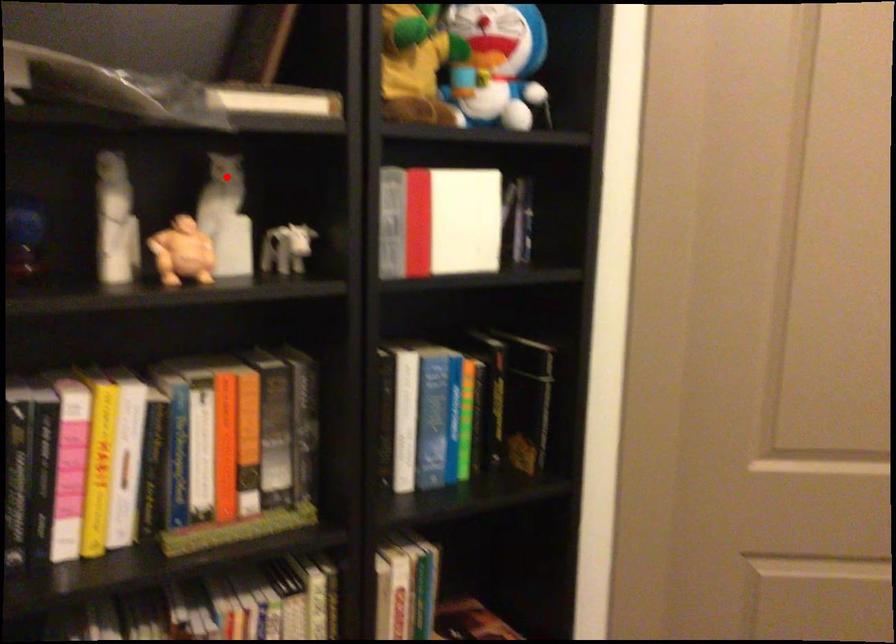
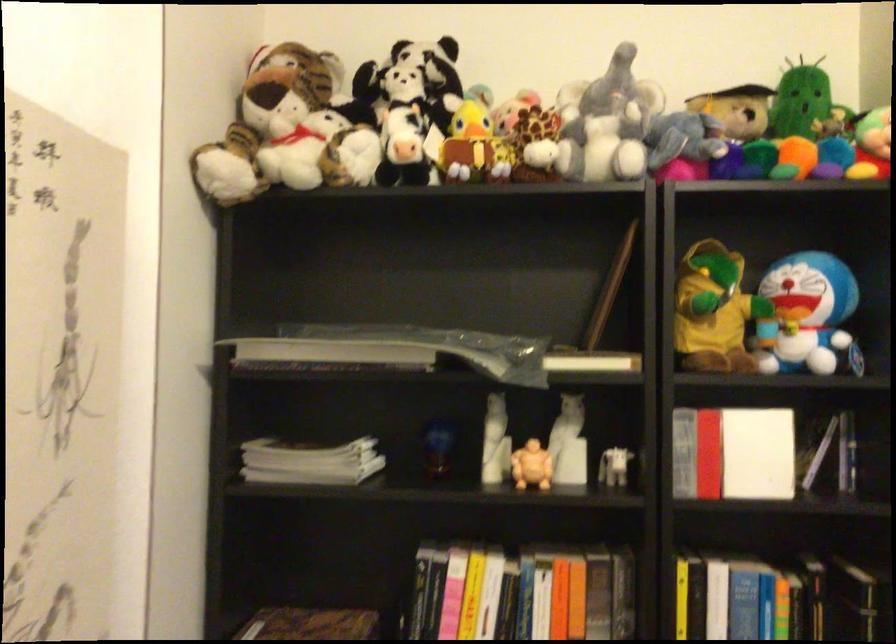
Question: A red point is marked in image1. In image2, is the corresponding 3D point closer to the camera or farther? Reply with the corresponding letter.

Choices:
 (A) The corresponding 3D point is closer.
 (B) The corresponding 3D point is farther.

Answer: (B)